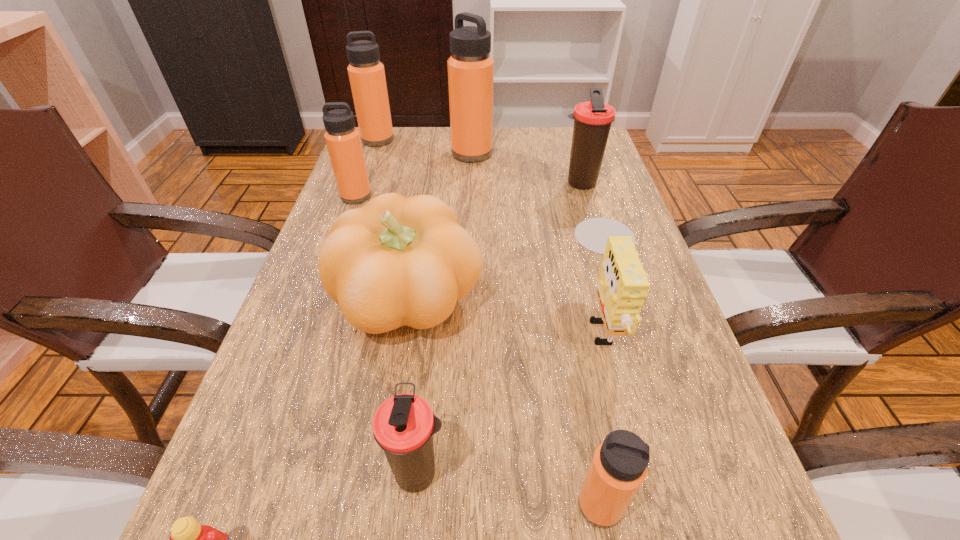
In the image, there is a desktop. At what (x,y) coordinates should I click in order to perform the action: click on free space at the far left corner. Please return your answer as a coordinate pair (x, y). The width and height of the screenshot is (960, 540). Looking at the image, I should click on (410, 127).

The width and height of the screenshot is (960, 540). Identify the location of free space between the nearest orange thermos bottle and the right brown thermos bottle. (589, 345).

The width and height of the screenshot is (960, 540). I want to click on free space between the third farthest orange thermos bottle and the rightmost thermos bottle, so click(468, 190).

Find the location of a particular element. The width and height of the screenshot is (960, 540). vacant area between the pumpkin and the farther brown thermos bottle is located at coordinates (494, 242).

This screenshot has height=540, width=960. In order to click on empty space that is in between the yellow sponge and the second biggest orange thermos bottle in this screenshot , I will do `click(490, 228)`.

The height and width of the screenshot is (540, 960). What are the coordinates of `free space between the second thermos bottle from right to left and the nearer brown thermos bottle` in the screenshot? It's located at (509, 489).

I want to click on object that is the eighth closest to the rightmost orange thermos bottle, so click(366, 73).

Choose which object is the seventh nearest neighbor to the farther brown thermos bottle. Please provide its 2D coordinates. Your answer should be formatted as a tuple, i.e. [(x, y)], where the tuple contains the x and y coordinates of a point satisfying the conditions above.

[(618, 468)]

Choose which thermos bottle is the second nearest neighbor to the pumpkin. Please provide its 2D coordinates. Your answer should be formatted as a tuple, i.e. [(x, y)], where the tuple contains the x and y coordinates of a point satisfying the conditions above.

[(343, 140)]

Locate an element on the screen. Image resolution: width=960 pixels, height=540 pixels. thermos bottle identified as the third closest to the right brown thermos bottle is located at coordinates (366, 73).